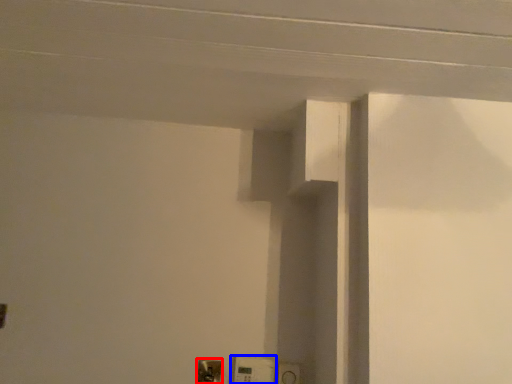
Question: Which object is further to the camera taking this photo, light switch (highlighted by a red box) or light switch (highlighted by a blue box)?

Choices:
 (A) light switch
 (B) light switch

Answer: (A)